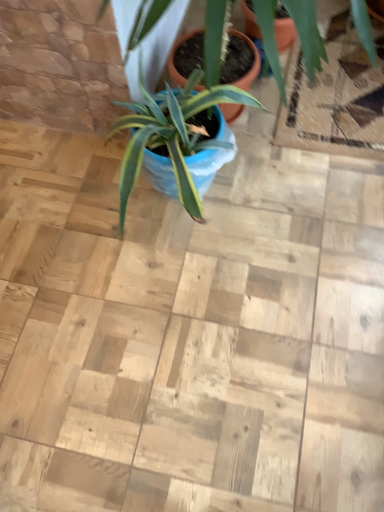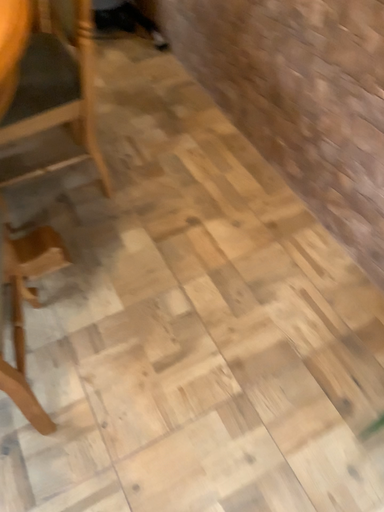
Question: Which way did the camera rotate in the video?

Choices:
 (A) rotated upward
 (B) rotated downward

Answer: (A)